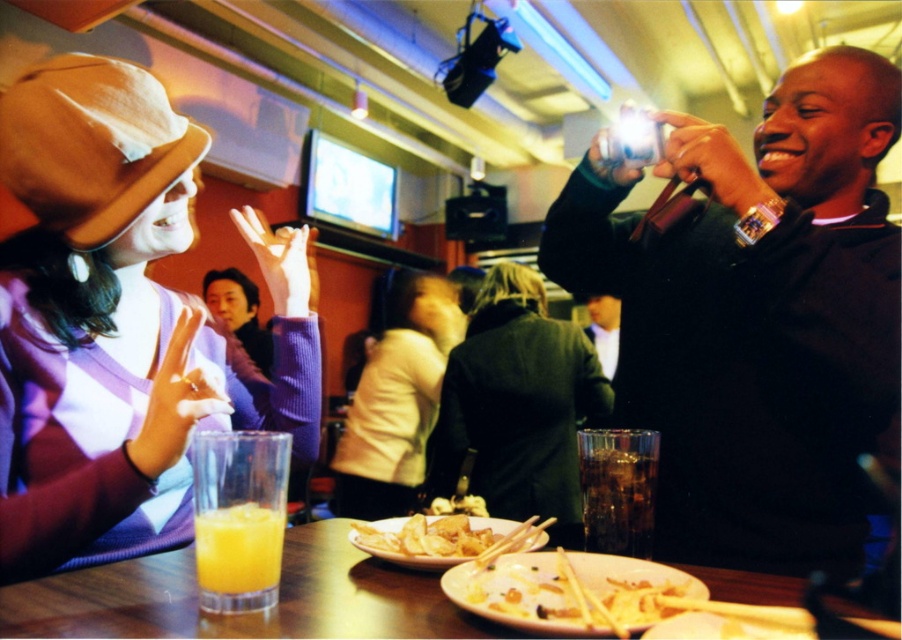
Can you confirm if matte purple sweater at center is thinner than light beige sweater at center?

Indeed, matte purple sweater at center has a lesser width compared to light beige sweater at center.

Based on the photo, between matte purple sweater at center and light beige sweater at center, which one has less height?

matte purple sweater at center

Who is more distant from viewer, (x=66, y=404) or (x=412, y=380)?

The point (x=412, y=380) is more distant.

Find the location of `matte purple sweater at center`. matte purple sweater at center is located at coordinates (121, 323).

Which is below, matte purple sweater at center or translucent glass orange juice at lower left?

translucent glass orange juice at lower left is below.

Measure the distance between point (77, 387) and camera.

Point (77, 387) is 36.54 inches away from camera.

I want to click on matte purple sweater at center, so click(x=121, y=323).

Does matte purple sweater at center have a lesser width compared to translucent glass table at center?

Correct, matte purple sweater at center's width is less than translucent glass table at center's.

Is matte purple sweater at center positioned at the back of translucent glass table at center?

Yes, it is.

At what (x,y) coordinates should I click in order to perform the action: click on matte purple sweater at center. Please return your answer as a coordinate pair (x, y). This screenshot has width=902, height=640. Looking at the image, I should click on (121, 323).

Where is `matte purple sweater at center`? This screenshot has height=640, width=902. matte purple sweater at center is located at coordinates (121, 323).